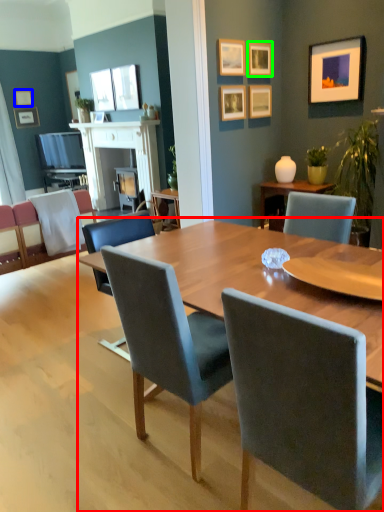
Question: Which object is the closest to the kitchen & dining room table (highlighted by a red box)? Choose among these: picture frame (highlighted by a blue box) or picture frame (highlighted by a green box).

Choices:
 (A) picture frame
 (B) picture frame

Answer: (B)